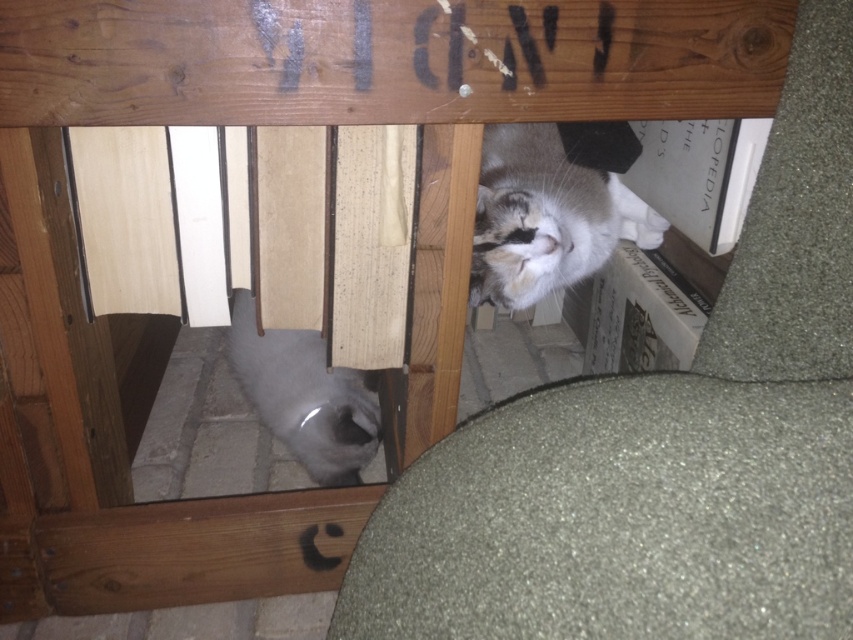
You are a cat owner who wants to place a cat tree in the living room. You have two cats, the soft gray cat at center and the gray fur cat at lower left. Based on their sizes, which cat would need a taller cat tree?

The soft gray cat at center is much taller than the gray fur cat at lower left, so it would need a taller cat tree.

You are a cat owner trying to place two cat beds in the wooden structure. The white fur cat at upper right and the gray fur cat at lower left both need their own beds. Based on their positions and sizes, which cat requires a wider bed?

The white fur cat at upper right requires a wider bed because it might be wider than the gray fur cat at lower left according to the description.

Based on the photo, you are a cat owner who wants to place a toy between the white fur cat at upper right and the gray fur cat at lower left. How much space do you need to ensure the toy is placed exactly between them?

To place the toy exactly between the white fur cat at upper right and the gray fur cat at lower left, you need to allocate 13.79 inches of space between them.